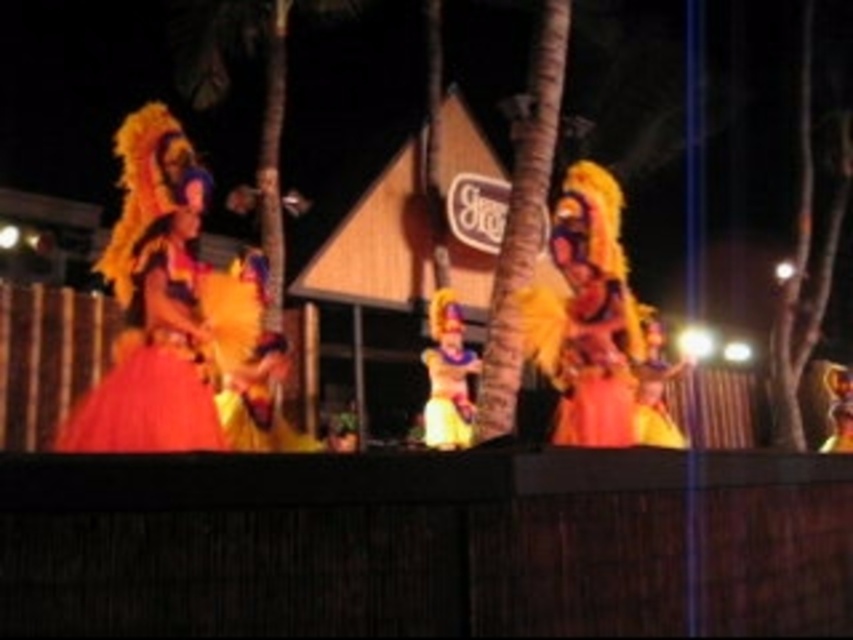
Question: Which object is the farthest from the shiny gold costume at center?

Choices:
 (A) shiny orange dress at left
 (B) brown textured palm tree at center

Answer: (A)

Question: Is shiny orange costume at center positioned in front of shiny gold costume at center?

Choices:
 (A) yes
 (B) no

Answer: (A)

Question: Can you confirm if brown textured palm tree at center is smaller than shiny gold costume at center?

Choices:
 (A) yes
 (B) no

Answer: (B)

Question: Among these points, which one is farthest from the camera?

Choices:
 (A) (460, 394)
 (B) (590, 419)
 (C) (190, 192)

Answer: (A)

Question: Which point is farther to the camera?

Choices:
 (A) brown textured palm tree at center
 (B) shiny orange dress at left

Answer: (A)

Question: Does shiny orange dress at left have a lesser width compared to shiny gold costume at center?

Choices:
 (A) no
 (B) yes

Answer: (A)